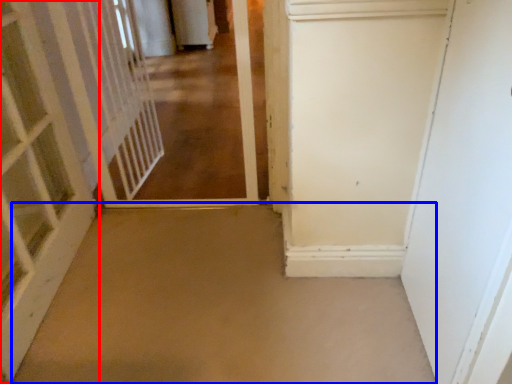
Question: Which point is closer to the camera, door (highlighted by a red box) or concrete (highlighted by a blue box)?

Choices:
 (A) door
 (B) concrete

Answer: (A)